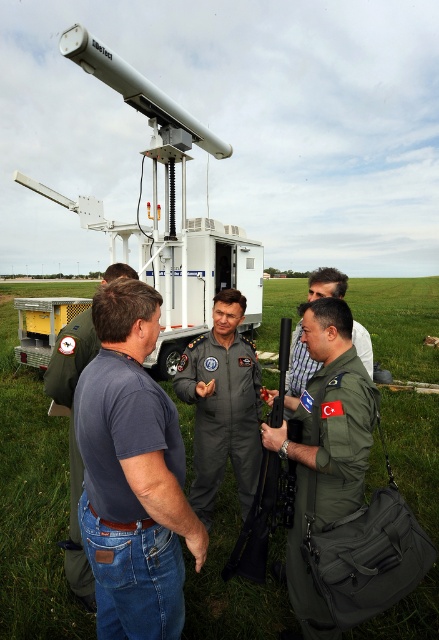
You are a drone operator trying to navigate between two points in the field. You need to determine which point is closer to your current position. Which of the two points, point (230, 452) or point (309, 355), is closer to you?

Point (230, 452) is further to the viewer than point (309, 355), so the closer point to you would be point (309, 355).

You are a photographer trying to capture a group photo of the dark gray uniform at center and the green uniform at center. Since you want to ensure both are visible in the frame, which uniform should you position closer to the camera to avoid being blocked?

The green uniform at center is behind the dark gray uniform at center, so to avoid blocking, position the dark gray uniform at center closer to the camera.

You are a photographer trying to capture a candid shot of the dark gray uniform at center and the matte black rifle at center in the scene. Your camera has a minimum focus distance of 25 inches. Can you take a photo of both objects without moving closer than 25 inches?

The dark gray uniform at center and the matte black rifle at center are 26.05 inches apart, so yes, you can take a photo of both objects without moving closer than 25 inches because the distance between them is within the camera focus range.